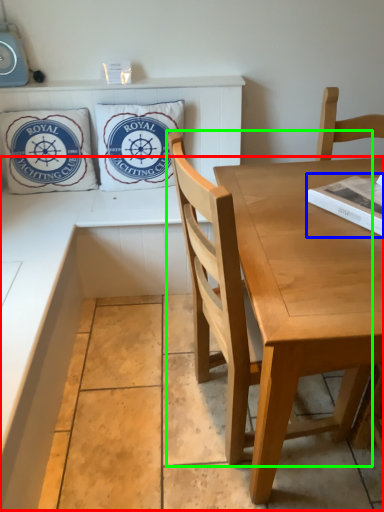
Question: Which object is the closest to the counter (highlighted by a red box)? Choose among these: magazine (highlighted by a blue box) or chair (highlighted by a green box).

Choices:
 (A) magazine
 (B) chair

Answer: (B)